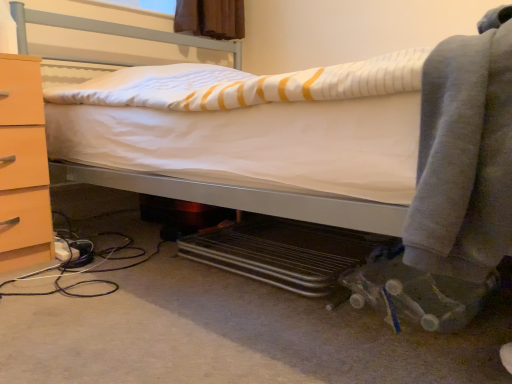
Image resolution: width=512 pixels, height=384 pixels. Describe the element at coordinates (465, 155) in the screenshot. I see `gray fleece blanket at lower right` at that location.

This screenshot has width=512, height=384. In order to click on gray fleece blanket at lower right in this screenshot , I will do `click(465, 155)`.

What is the approximate width of gray fleece blanket at lower right?

gray fleece blanket at lower right is 23.69 inches in width.

Locate an element on the screen. This screenshot has height=384, width=512. matte wood chest of drawers at left is located at coordinates (23, 166).

The height and width of the screenshot is (384, 512). Describe the element at coordinates (23, 166) in the screenshot. I see `matte wood chest of drawers at left` at that location.

Locate an element on the screen. This screenshot has width=512, height=384. gray fleece blanket at lower right is located at coordinates (465, 155).

Which is more to the left, matte wood chest of drawers at left or gray fleece blanket at lower right?

matte wood chest of drawers at left.

Which object is further away from the camera, matte wood chest of drawers at left or gray fleece blanket at lower right?

matte wood chest of drawers at left is further from the camera.

Between point (1, 93) and point (467, 259), which one is positioned behind?

The point (1, 93) is behind.

From the image's perspective, between matte wood chest of drawers at left and gray fleece blanket at lower right, who is located below?

From the image's view, matte wood chest of drawers at left is below.

From a real-world perspective, which object stands above the other?

gray fleece blanket at lower right is physically above.

Considering the sizes of objects matte wood chest of drawers at left and gray fleece blanket at lower right in the image provided, who is wider, matte wood chest of drawers at left or gray fleece blanket at lower right?

Wider between the two is gray fleece blanket at lower right.

Can you confirm if matte wood chest of drawers at left is shorter than gray fleece blanket at lower right?

Incorrect, the height of matte wood chest of drawers at left does not fall short of that of gray fleece blanket at lower right.

Can you confirm if matte wood chest of drawers at left is bigger than gray fleece blanket at lower right?

Indeed, matte wood chest of drawers at left has a larger size compared to gray fleece blanket at lower right.

Is matte wood chest of drawers at left not within gray fleece blanket at lower right?

Indeed, matte wood chest of drawers at left is completely outside gray fleece blanket at lower right.

Based on the photo, is matte wood chest of drawers at left far from gray fleece blanket at lower right?

Yes, matte wood chest of drawers at left and gray fleece blanket at lower right are located far from each other.

Is matte wood chest of drawers at left aimed at gray fleece blanket at lower right?

No.

How different are the orientations of matte wood chest of drawers at left and gray fleece blanket at lower right in degrees?

89.6 degrees.

Identify the location of clothing on the right of matte wood chest of drawers at left. (465, 155).

Is gray fleece blanket at lower right to the left or to the right of matte wood chest of drawers at left in the image?

In the image, gray fleece blanket at lower right appears on the right side of matte wood chest of drawers at left.

Which is behind, gray fleece blanket at lower right or matte wood chest of drawers at left?

Positioned behind is matte wood chest of drawers at left.

Which point is more forward, (482, 23) or (14, 74)?

Positioned in front is point (482, 23).

From the picture: From the image's perspective, is gray fleece blanket at lower right above matte wood chest of drawers at left?

Yes, from the image's perspective, gray fleece blanket at lower right is on top of matte wood chest of drawers at left.

From a real-world perspective, which object stands above the other?

gray fleece blanket at lower right is physically above.

In terms of width, does gray fleece blanket at lower right look wider or thinner when compared to matte wood chest of drawers at left?

Clearly, gray fleece blanket at lower right has more width compared to matte wood chest of drawers at left.

Which of these two, gray fleece blanket at lower right or matte wood chest of drawers at left, stands shorter?

Standing shorter between the two is gray fleece blanket at lower right.

Does gray fleece blanket at lower right have a larger size compared to matte wood chest of drawers at left?

Actually, gray fleece blanket at lower right might be smaller than matte wood chest of drawers at left.

Is matte wood chest of drawers at left completely or partially inside gray fleece blanket at lower right?

No, matte wood chest of drawers at left is not a part of gray fleece blanket at lower right.

Can you see gray fleece blanket at lower right touching matte wood chest of drawers at left?

No, gray fleece blanket at lower right is not in contact with matte wood chest of drawers at left.

Is gray fleece blanket at lower right turned away from matte wood chest of drawers at left?

No, gray fleece blanket at lower right's orientation is not away from matte wood chest of drawers at left.

What's the angular difference between gray fleece blanket at lower right and matte wood chest of drawers at left's facing directions?

gray fleece blanket at lower right and matte wood chest of drawers at left are facing 89.6 degrees away from each other.

At what (x,y) coordinates should I click in order to perform the action: click on the chest of drawers beneath the gray fleece blanket at lower right (from a real-world perspective). Please return your answer as a coordinate pair (x, y). Looking at the image, I should click on (23, 166).

Where is `the chest of drawers that is below the gray fleece blanket at lower right (from the image's perspective)`? the chest of drawers that is below the gray fleece blanket at lower right (from the image's perspective) is located at coordinates (23, 166).

I want to click on clothing that appears above the matte wood chest of drawers at left (from a real-world perspective), so click(x=465, y=155).